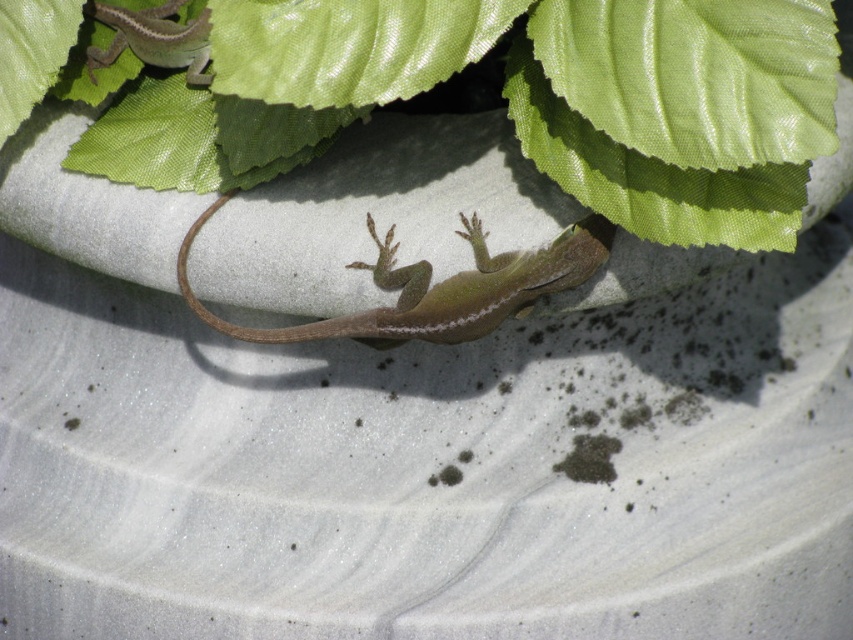
You are standing in a garden and see the green matte lizard at center and the green leafy plant at upper center. Which object is nearer to you?

The green matte lizard at center is closer to the viewer than the green leafy plant at upper center.

You are an animal caretaker observing the scene. You need to determine which object is larger between the green matte lizard at center and the green leafy plant at upper center. Which one is bigger?

The green leafy plant at upper center is larger than the green matte lizard at center.